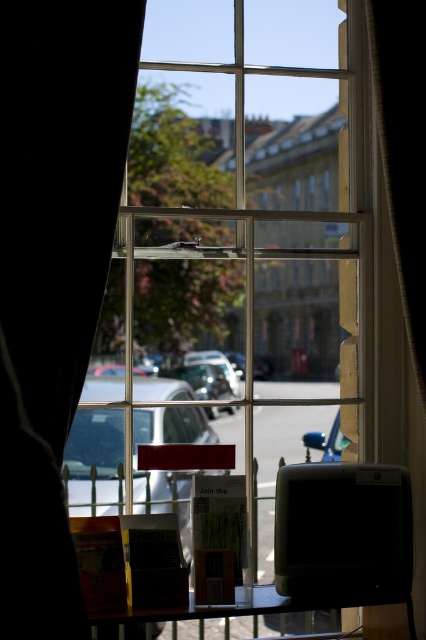
Question: Considering the real-world distances, which object is farthest from the shiny blue car at center?

Choices:
 (A) black fabric curtain at right
 (B) wooden table at lower center

Answer: (A)

Question: Is black fabric curtain at right behind shiny blue car at center?

Choices:
 (A) yes
 (B) no

Answer: (B)

Question: Can you confirm if black matte curtain at left is positioned above metallic silver car at center?

Choices:
 (A) no
 (B) yes

Answer: (B)

Question: Can you confirm if black fabric curtain at right is positioned to the left of metallic silver car at center?

Choices:
 (A) yes
 (B) no

Answer: (B)

Question: Which object appears closest to the camera in this image?

Choices:
 (A) black fabric curtain at right
 (B) wooden table at lower center

Answer: (B)

Question: Which point is farther to the camera?

Choices:
 (A) (345, 442)
 (B) (106, 618)
 (C) (164, 413)

Answer: (A)